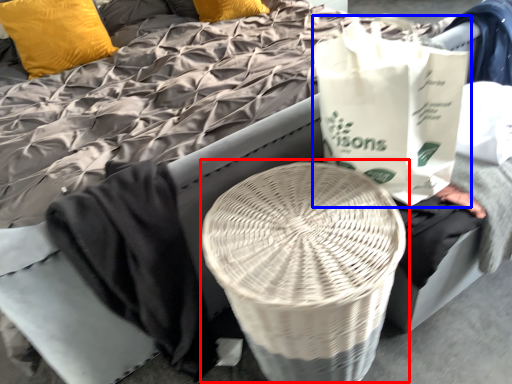
Question: Which object appears closest to the camera in this image, round table (highlighted by a red box) or grocery bag (highlighted by a blue box)?

Choices:
 (A) round table
 (B) grocery bag

Answer: (A)